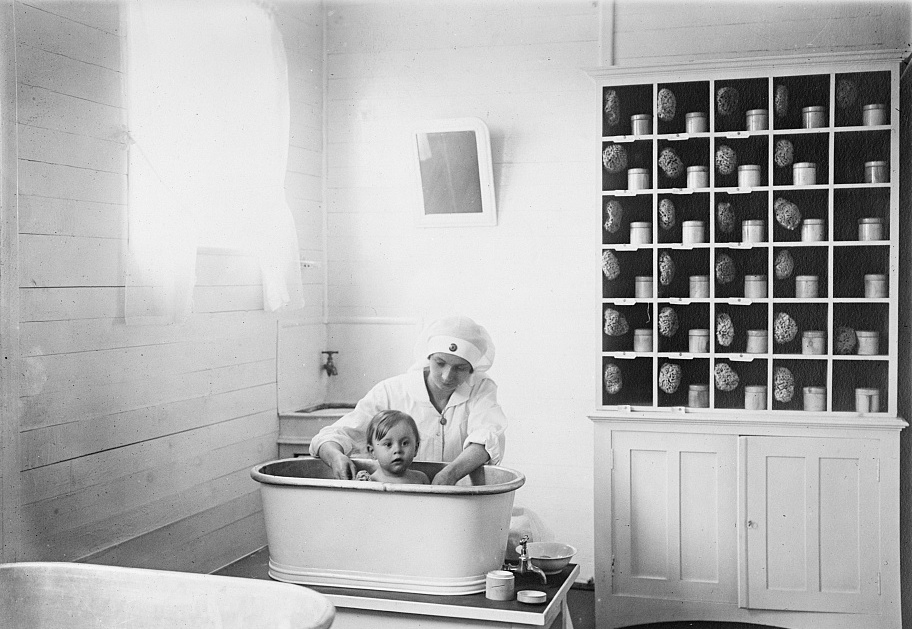
What are the coordinates of `mirror` in the screenshot? It's located at (443, 169).